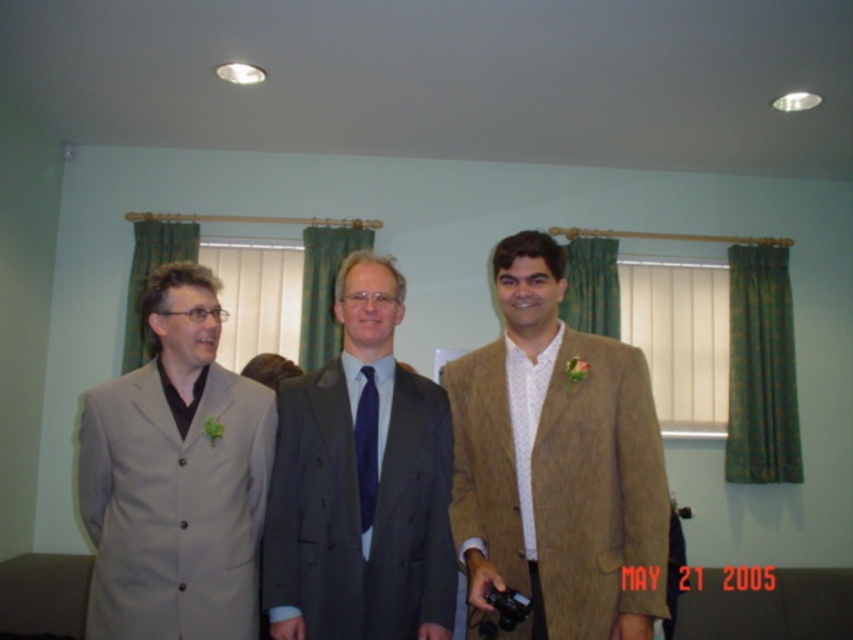
Consider the image. Does tan textured suit at center appear on the right side of navy blue silk tie at center?

Correct, you'll find tan textured suit at center to the right of navy blue silk tie at center.

Does tan textured suit at center come in front of navy blue silk tie at center?

Yes, it is in front of navy blue silk tie at center.

Between point (642, 419) and point (358, 484), which one is positioned behind?

The point (358, 484) is more distant.

The height and width of the screenshot is (640, 853). In order to click on tan textured suit at center in this screenshot , I will do `click(556, 461)`.

Does matte beige suit at left have a greater height compared to matte gray suit at center?

No.

What do you see at coordinates (175, 476) in the screenshot? Image resolution: width=853 pixels, height=640 pixels. I see `matte beige suit at left` at bounding box center [175, 476].

The width and height of the screenshot is (853, 640). Find the location of `matte beige suit at left`. matte beige suit at left is located at coordinates (175, 476).

This screenshot has height=640, width=853. In order to click on matte beige suit at left in this screenshot , I will do `click(175, 476)`.

Who is shorter, tan textured suit at center or matte beige suit at left?

matte beige suit at left

You are a GUI agent. You are given a task and a screenshot of the screen. Output one action in this format:
    pyautogui.click(x=<x>, y=<y>)
    Task: Click on the tan textured suit at center
    The height and width of the screenshot is (640, 853).
    Given the screenshot: What is the action you would take?
    pyautogui.click(x=556, y=461)

This screenshot has width=853, height=640. What are the coordinates of `tan textured suit at center` in the screenshot? It's located at (556, 461).